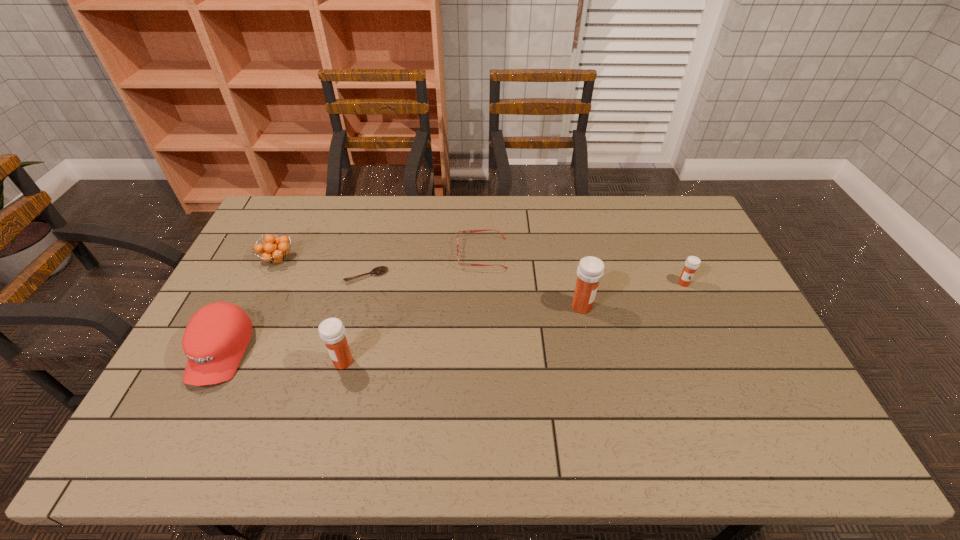
I want to click on the second shortest medicine, so click(332, 332).

Identify the location of the leftmost medicine. (332, 332).

The width and height of the screenshot is (960, 540). I want to click on the second medicine from left to right, so click(x=590, y=270).

Identify the location of the sixth object from left to right. (590, 270).

Where is `the farthest medicine`? This screenshot has height=540, width=960. the farthest medicine is located at coordinates (692, 263).

Identify the location of the shortest medicine. This screenshot has width=960, height=540. (692, 263).

Identify the location of spectacles. (469, 231).

Where is `the sixth tallest object`? This screenshot has height=540, width=960. the sixth tallest object is located at coordinates (469, 231).

This screenshot has width=960, height=540. What are the coordinates of `orange fruit` in the screenshot? It's located at (275, 250).

I want to click on soupspoon, so click(x=379, y=270).